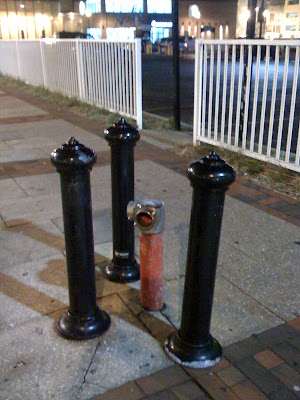
Locate an element on the screen. The width and height of the screenshot is (300, 400). concrete tiled floor is located at coordinates (57, 331), (181, 223), (42, 181), (27, 133), (6, 106).